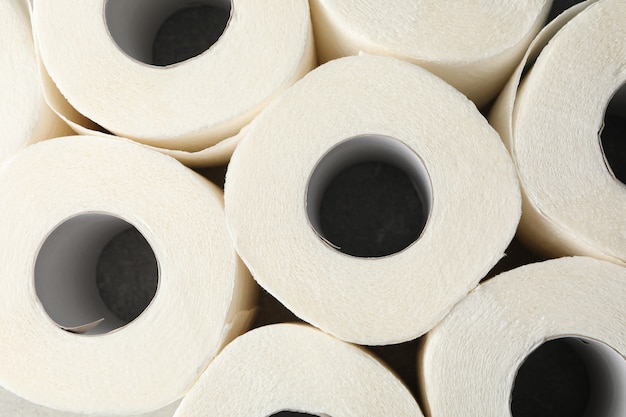
This screenshot has height=417, width=626. Identify the location of top view of toilet paper roll. [519, 331], [466, 245], [572, 100], [451, 35], [176, 68], [123, 185], [7, 120], [282, 374].